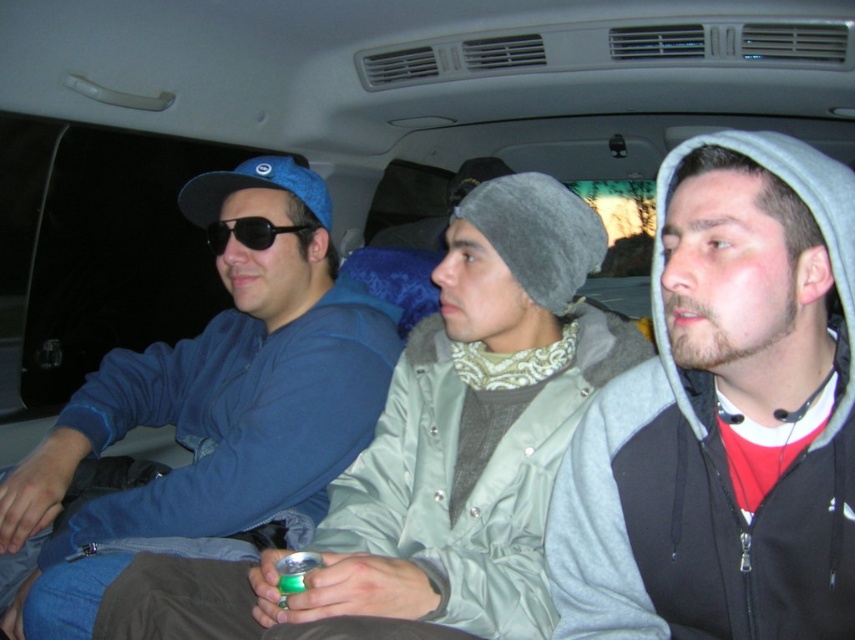
You are a photographer trying to take a photo of the gray fleece hoodie at right from where you are standing. The camera is on a tripod 3 feet away from the hoodie. Can you adjust the camera position to capture the entire hoodie in the frame without moving the hoodie?

The gray fleece hoodie at right and camera are 28.49 inches apart. Since 28.49 inches is approximately 2.37 feet, which is less than the 3 feet distance mentioned, you need to move the camera closer to the hoodie to capture it fully in the frame.

You are a photographer trying to capture the gray fleece hoodie at right in the image. Based on its 2D coordinates, where should you focus your camera lens?

The gray fleece hoodie at right is located at the 2D coordinates point 0.650 on the x axis and 0.848 on the y axis, so you should focus your camera lens at that point to capture it.

You are a delivery driver who needs to fit two packages into the back of your van. The packages must be placed next to the passengers to ensure they are visible. The gray fleece hoodie at right and the matte blue jacket at center are already occupying space. Which package should you place closer to the driver if the smaller package is easier to handle?

The gray fleece hoodie at right is smaller than the matte blue jacket at center, so you should place the smaller package next to the gray fleece hoodie at right to ensure easier handling and visibility.